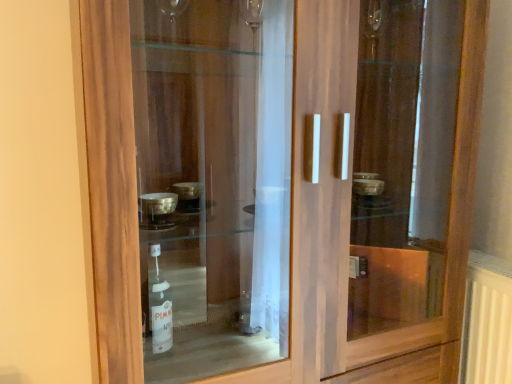
The height and width of the screenshot is (384, 512). What do you see at coordinates (487, 321) in the screenshot?
I see `white plastic radiator at lower right` at bounding box center [487, 321].

The width and height of the screenshot is (512, 384). I want to click on white plastic radiator at lower right, so click(487, 321).

The width and height of the screenshot is (512, 384). In order to click on white plastic radiator at lower right in this screenshot , I will do `click(487, 321)`.